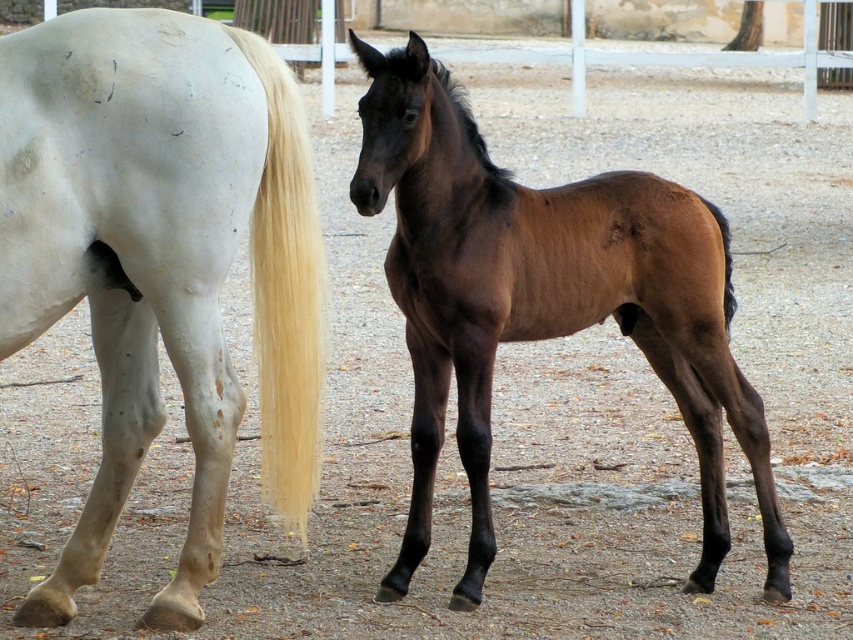
Can you confirm if white glossy horse at left is positioned below brown glossy tail at right?

Yes.

Is white glossy horse at left to the right of brown glossy tail at right from the viewer's perspective?

Incorrect, white glossy horse at left is not on the right side of brown glossy tail at right.

The width and height of the screenshot is (853, 640). What are the coordinates of `white glossy horse at left` in the screenshot? It's located at (161, 260).

Is white glossy horse at left smaller than black silky mane at center?

Actually, white glossy horse at left might be larger than black silky mane at center.

Who is more distant from viewer, (225, 266) or (485, 154)?

Positioned behind is point (485, 154).

What are the coordinates of `white glossy horse at left` in the screenshot? It's located at (161, 260).

Does white glossy horse at left have a greater width compared to blonde silky tail at left?

Indeed, white glossy horse at left has a greater width compared to blonde silky tail at left.

Does white glossy horse at left appear on the right side of blonde silky tail at left?

Incorrect, white glossy horse at left is not on the right side of blonde silky tail at left.

Which is in front, point (125, 264) or point (225, 29)?

Point (125, 264)

This screenshot has height=640, width=853. Identify the location of white glossy horse at left. (161, 260).